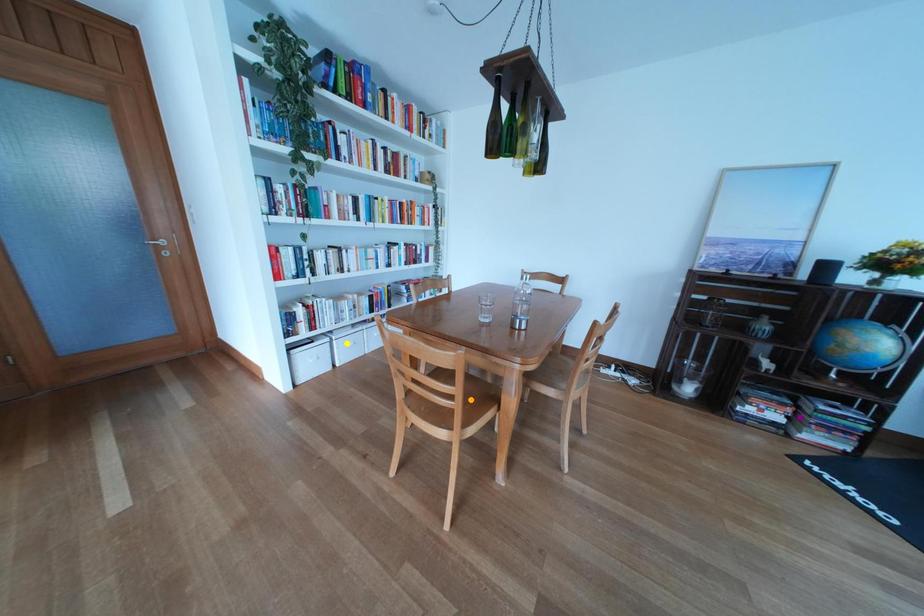
Order these from nearest to farthest:
purple point, orange point, yellow point

yellow point, purple point, orange point